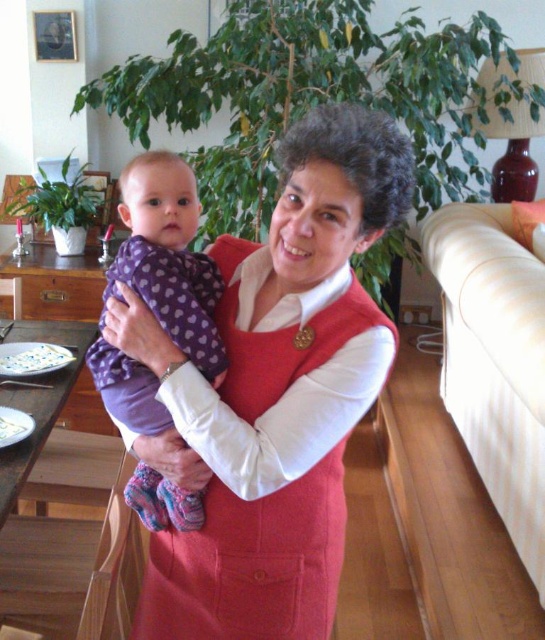
Question: Among these objects, which one is nearest to the camera?

Choices:
 (A) purple fleece onesie at center
 (B) matte red dress at center

Answer: (B)

Question: Is matte red dress at center behind purple fleece onesie at center?

Choices:
 (A) yes
 (B) no

Answer: (B)

Question: Can you confirm if matte red dress at center is smaller than purple fleece onesie at center?

Choices:
 (A) yes
 (B) no

Answer: (B)

Question: Which object is farther from the camera taking this photo?

Choices:
 (A) matte red dress at center
 (B) purple fleece onesie at center

Answer: (B)

Question: Does matte red dress at center appear on the left side of purple fleece onesie at center?

Choices:
 (A) no
 (B) yes

Answer: (A)